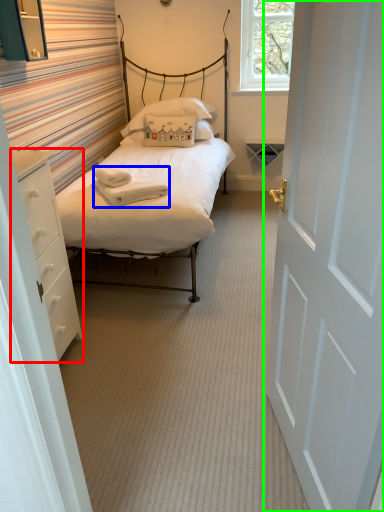
Question: Based on their relative distances, which object is farther from nightstand (highlighted by a red box)? Choose from blanket (highlighted by a blue box) and door (highlighted by a green box).

Choices:
 (A) blanket
 (B) door

Answer: (B)